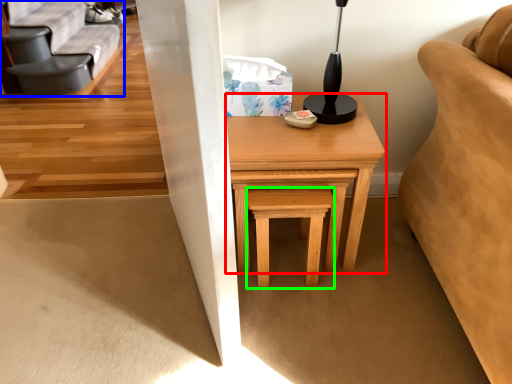
Question: Considering the real-world distances, which object is farthest from table (highlighted by a red box)? futon (highlighted by a blue box) or stool (highlighted by a green box)?

Choices:
 (A) futon
 (B) stool

Answer: (A)